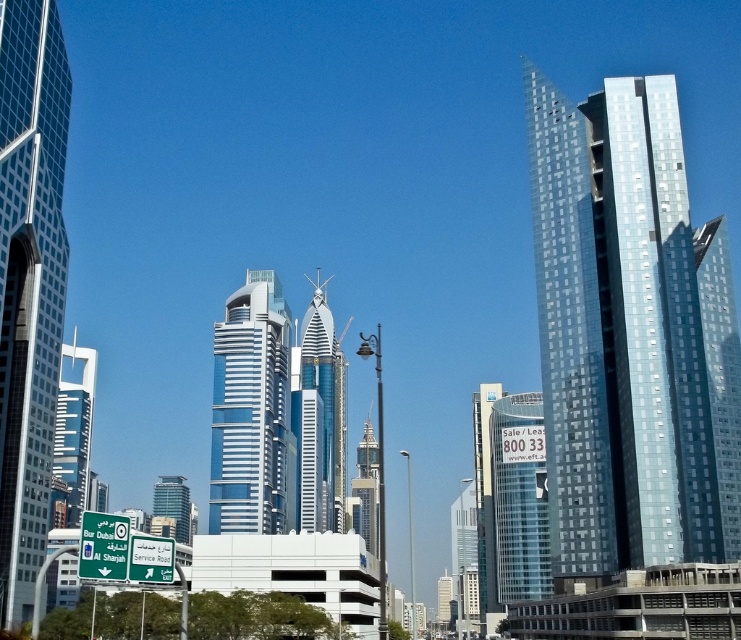
You are a drone operator planning to fly a drone between the glassy steel skyscraper at left and the glassy blue skyscraper at center. The drone has a maximum flight distance of 150 meters. Can the drone safely fly between them without exceeding its range?

The distance between the glassy steel skyscraper at left and the glassy blue skyscraper at center is 159.05 meters, which exceeds the drone operator maximum flight distance of 150 meters. Therefore, the drone cannot safely fly between them without exceeding its range.

You are standing on the road sign and looking towards the skyline. Which skyscraper is higher in your view, the shiny glass skyscraper at right or the glassy steel skyscraper at left?

The shiny glass skyscraper at right is higher in your view because it is positioned above the glassy steel skyscraper at left.

You are standing at the road sign in the foreground of the urban skyline. You see two points marked in the image. Which point is nearer to you? The two points are point at coordinate (645, 77) and point at coordinate (502, 476).

Point at coordinate (645, 77) is closer to the viewer than point at coordinate (502, 476).